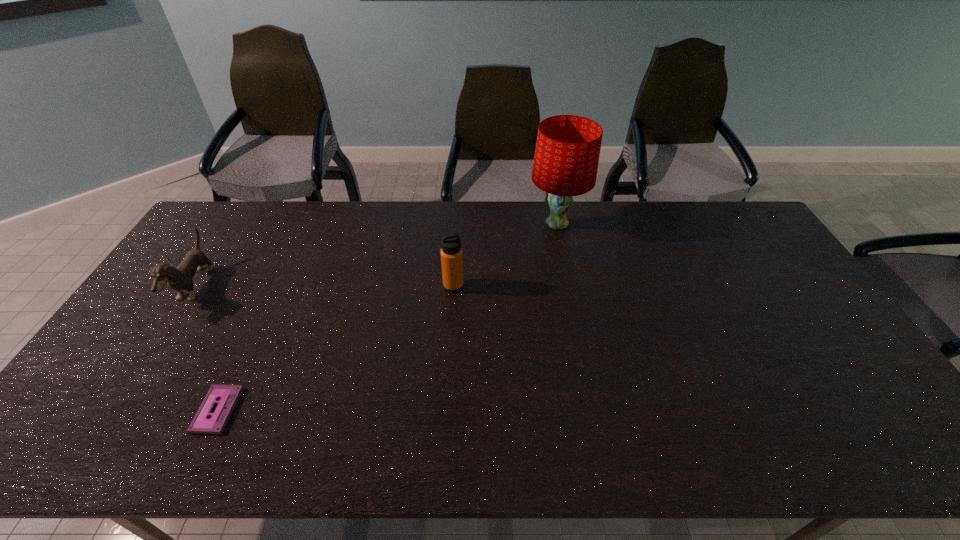
Identify the location of the farthest object. The image size is (960, 540). (567, 151).

Find the location of a particular element. the tallest object is located at coordinates (567, 151).

The height and width of the screenshot is (540, 960). In order to click on thermos bottle in this screenshot , I will do `click(451, 252)`.

Locate an element on the screen. The width and height of the screenshot is (960, 540). the third object from left to right is located at coordinates (451, 252).

At what (x,y) coordinates should I click in order to perform the action: click on the leftmost object. Please return your answer as a coordinate pair (x, y). The width and height of the screenshot is (960, 540). Looking at the image, I should click on (180, 278).

The width and height of the screenshot is (960, 540). What are the coordinates of `the second shortest object` in the screenshot? It's located at (180, 278).

The image size is (960, 540). Find the location of `the nearest object`. the nearest object is located at coordinates (228, 395).

Locate an element on the screen. the shortest object is located at coordinates (228, 395).

Locate an element on the screen. This screenshot has height=540, width=960. free space located 0.400m on the front-facing side of the lampshade is located at coordinates (417, 224).

You are a GUI agent. You are given a task and a screenshot of the screen. Output one action in this format:
    pyautogui.click(x=<x>, y=<y>)
    Task: Click on the vacant area situated 0.140m on the front-facing side of the lampshade
    The height and width of the screenshot is (540, 960).
    Given the screenshot: What is the action you would take?
    pyautogui.click(x=489, y=224)